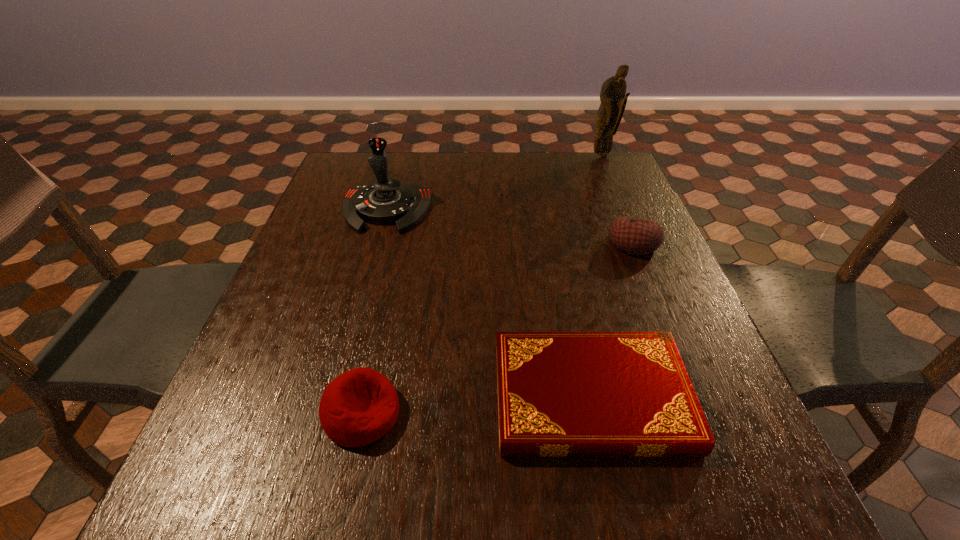
Find the location of a particular element. This screenshot has height=540, width=960. vacant space that satisfies the following two spatial constraints: 1. on the handle side of the fourth shortest object; 2. on the left side of the farther beanbag is located at coordinates (377, 244).